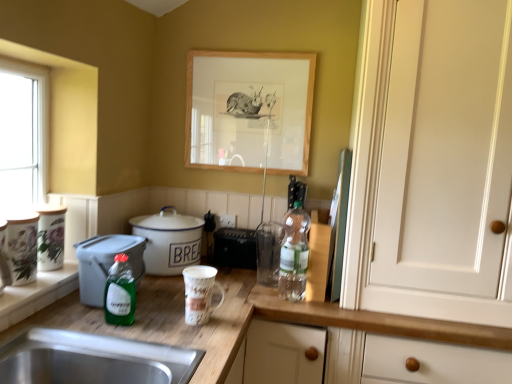
Question: From the image's perspective, relative to white enamel cooker at center, the 2th cooker viewed from the front, is green matte refrigerator at center-right, placed as the first appliance when sorted from right to left, above or below?

Choices:
 (A) below
 (B) above

Answer: (B)

Question: Looking at the image, does green matte refrigerator at center-right, which is the 3th appliance from front to back, seem bigger or smaller compared to white enamel cooker at center, the 2th cooker viewed from the front?

Choices:
 (A) small
 (B) big

Answer: (A)

Question: Which object is the closest to the white enamel cooker at center, positioned as the first cooker in back-to-front order?

Choices:
 (A) green glass bottle at center, which ranks as the 1th bottle in left-to-right order
 (B) black plastic toaster at center, which is counted as the 3th appliance, starting from the left
 (C) wooden picture frame at upper center
 (D) translucent plastic bottle at center, the first bottle from the right
 (E) porcelain floral canister at left, which ranks as the 1th appliance in left-to-right order

Answer: (B)

Question: Which is nearer to the white enamel cooker at center, positioned as the first cooker in back-to-front order?

Choices:
 (A) porcelain floral canister at left, which ranks as the 1th appliance in left-to-right order
 (B) green glass bottle at center, the first bottle in the front-to-back sequence
 (C) matte ceramic mug at center, which is the third appliance in right-to-left order
 (D) green matte refrigerator at center-right, the fourth appliance from the left
 (E) black plastic toaster at center, which is the 2th appliance in right-to-left order

Answer: (E)